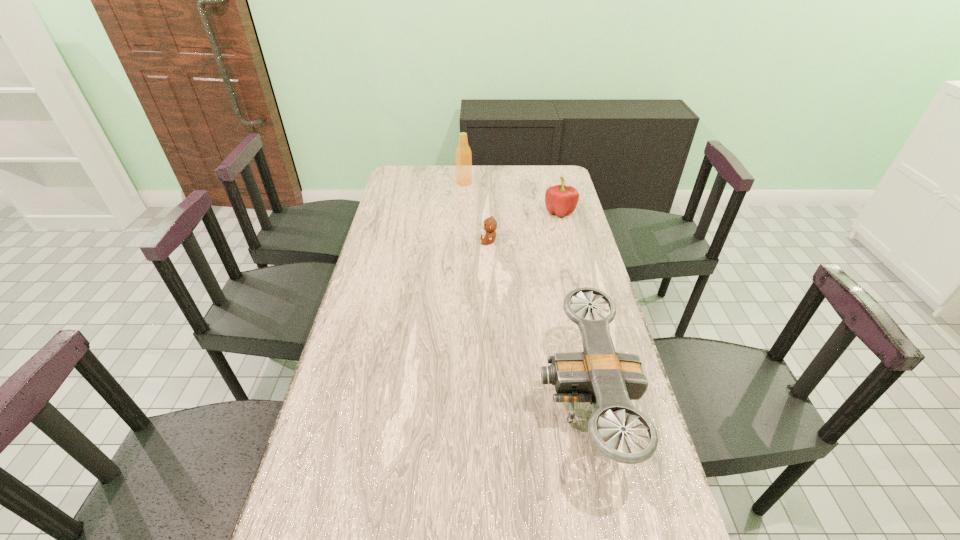
Locate an element on the screen. The width and height of the screenshot is (960, 540). vacant area at the left edge is located at coordinates (369, 282).

In the image, there is a desktop. Where is `vacant area at the right edge`? vacant area at the right edge is located at coordinates (559, 259).

Where is `vacant area that lies between the nearest object and the farthest object`? vacant area that lies between the nearest object and the farthest object is located at coordinates (524, 293).

You are a GUI agent. You are given a task and a screenshot of the screen. Output one action in this format:
    pyautogui.click(x=<x>, y=<y>)
    Task: Click on the empty space between the nearest object and the tallest object
    The width and height of the screenshot is (960, 540).
    Given the screenshot: What is the action you would take?
    pyautogui.click(x=524, y=293)

The height and width of the screenshot is (540, 960). I want to click on free area in between the third farthest object and the second shortest object, so click(524, 226).

Where is `free spot between the third shortest object and the second nearest object`? This screenshot has height=540, width=960. free spot between the third shortest object and the second nearest object is located at coordinates (537, 322).

In order to click on the third closest object relative to the drone in this screenshot , I will do `click(463, 156)`.

Where is `object that ranks as the second closest to the nearest object`? object that ranks as the second closest to the nearest object is located at coordinates (x=560, y=199).